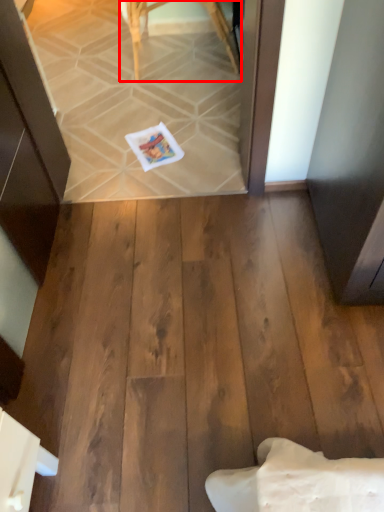
Question: In this image, where is furniture (annotated by the red box) located relative to postcard?

Choices:
 (A) right
 (B) left

Answer: (A)